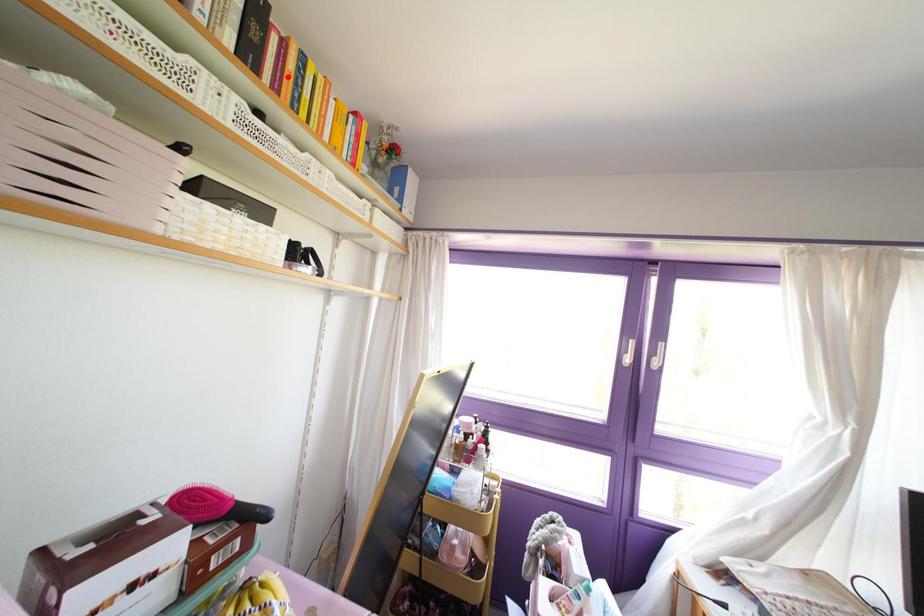
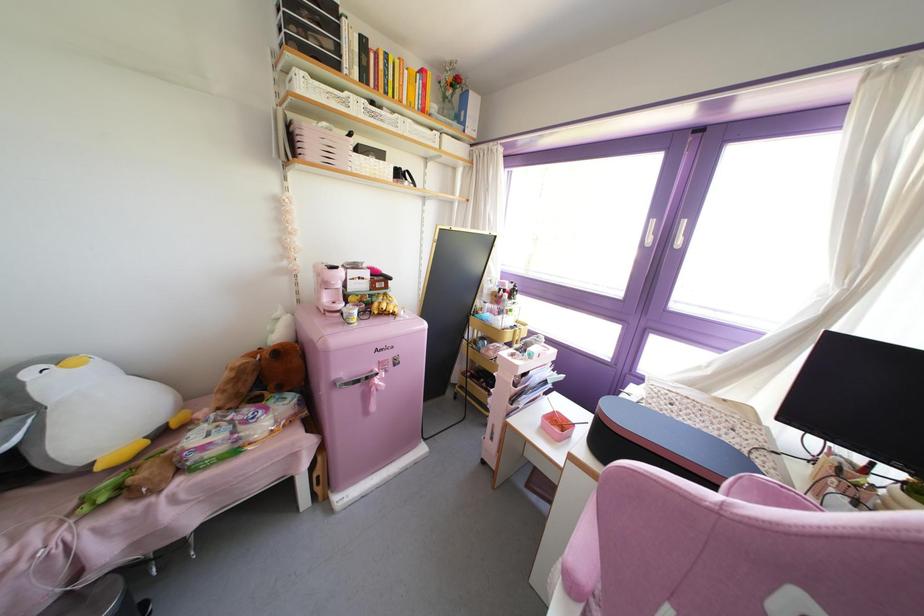
Find the pixel in the second image that matches the highlighted location in the first image.

(381, 74)